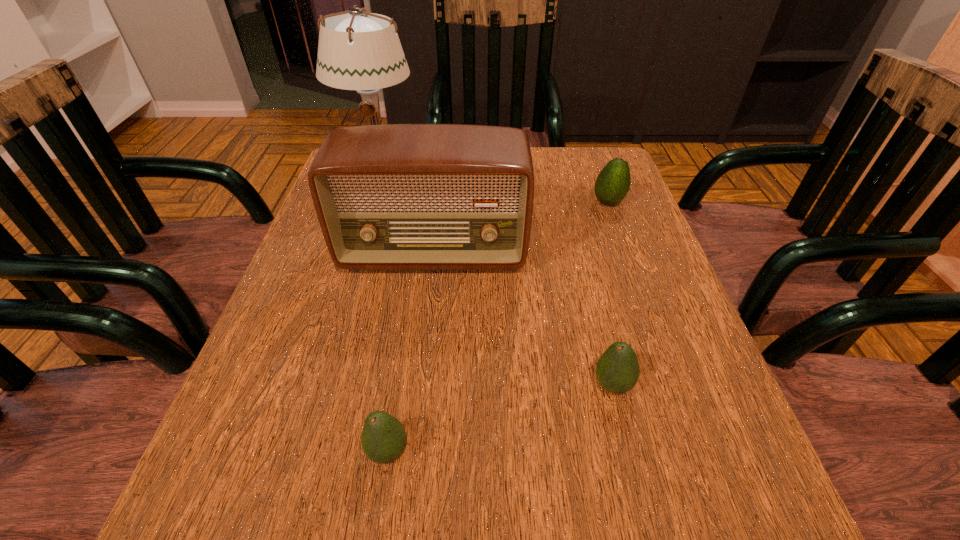
The image size is (960, 540). Identify the location of object located in the far right corner section of the desktop. (613, 182).

You are a GUI agent. You are given a task and a screenshot of the screen. Output one action in this format:
    pyautogui.click(x=<x>, y=<y>)
    Task: Click on the vacant space at the far edge of the desktop
    The image size is (960, 540).
    Given the screenshot: What is the action you would take?
    pyautogui.click(x=537, y=172)

Where is `vacant region at the near edge of the desktop`? The width and height of the screenshot is (960, 540). vacant region at the near edge of the desktop is located at coordinates (517, 536).

The width and height of the screenshot is (960, 540). Find the location of `free space at the left edge`. free space at the left edge is located at coordinates (319, 251).

This screenshot has height=540, width=960. In the image, there is a desktop. Find the location of `vacant space at the right edge`. vacant space at the right edge is located at coordinates (620, 233).

This screenshot has width=960, height=540. In order to click on vacant space at the near left corner of the desktop in this screenshot , I will do `click(275, 515)`.

This screenshot has width=960, height=540. In the image, there is a desktop. In order to click on free region at the far right corner in this screenshot , I will do `click(588, 170)`.

Find the location of a particular element. This screenshot has height=540, width=960. empty location between the tallest object and the nearest avocado is located at coordinates coord(384,310).

Find the location of `free point between the nearest object and the second nearest avocado`. free point between the nearest object and the second nearest avocado is located at coordinates (500, 418).

Identify the location of vacant area that lies between the leftmost avocado and the tallest object. (384, 310).